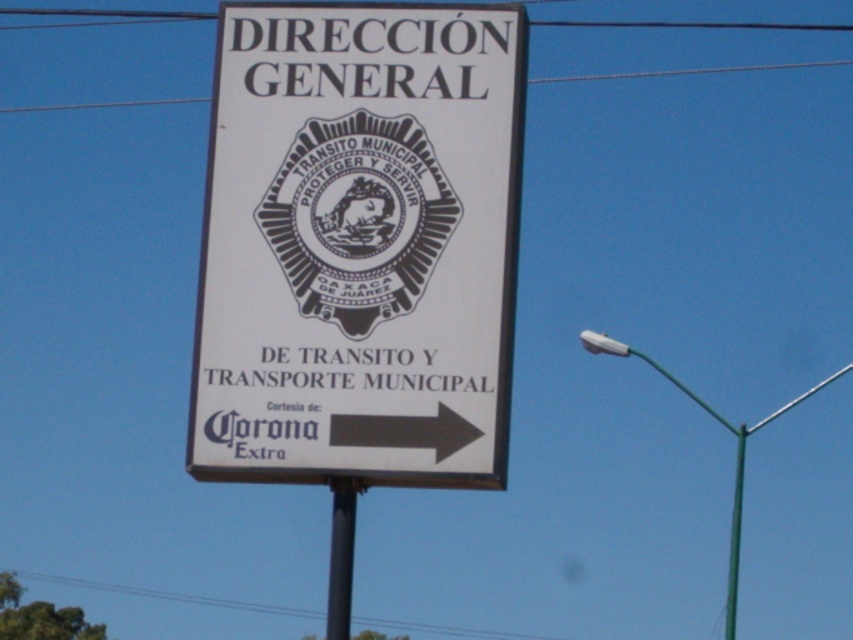
Question: Which point is farther to the camera?

Choices:
 (A) (236, 141)
 (B) (740, 452)

Answer: (B)

Question: Estimate the real-world distances between objects in this image. Which object is farther from the white paper sign at center?

Choices:
 (A) green metallic pole at right
 (B) metallic wire at upper center

Answer: (B)

Question: Among these points, which one is farthest from the camera?

Choices:
 (A) (338, 484)
 (B) (737, 426)
 (C) (677, 28)

Answer: (C)

Question: Does green metallic pole at right have a larger size compared to metallic pole at center?

Choices:
 (A) no
 (B) yes

Answer: (B)

Question: In this image, where is white paper sign at center located relative to metallic wire at upper center?

Choices:
 (A) below
 (B) above

Answer: (A)

Question: Observing the image, what is the correct spatial positioning of green metallic pole at right in reference to metallic wire at upper center?

Choices:
 (A) right
 (B) left

Answer: (A)